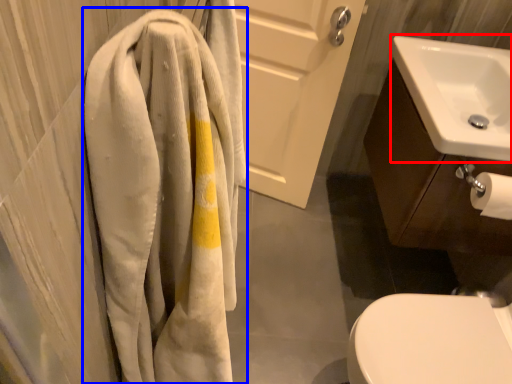
Question: Which of the following is the closest to the observer, sink (highlighted by a red box) or towel (highlighted by a blue box)?

Choices:
 (A) sink
 (B) towel

Answer: (B)